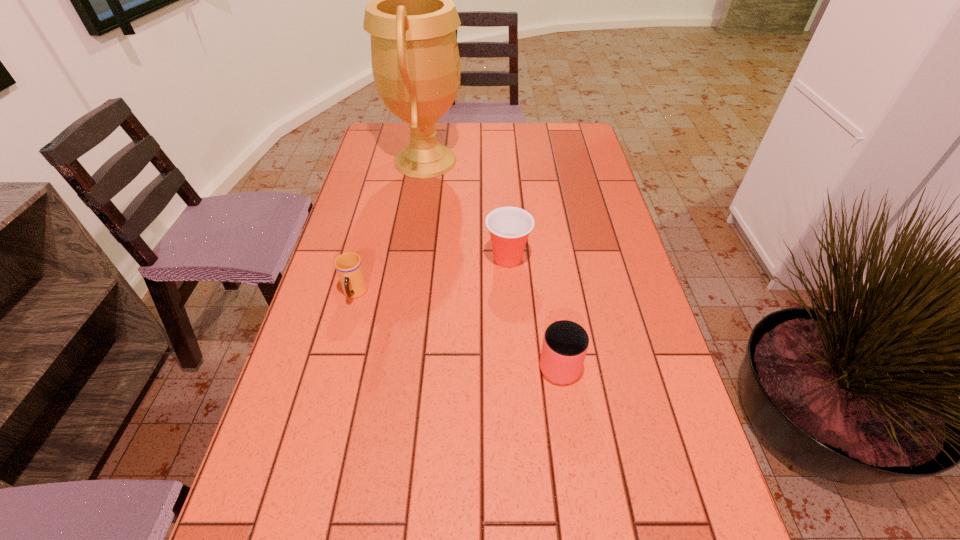
Where is `object that is the third closest to the second farthest cup`? object that is the third closest to the second farthest cup is located at coordinates (565, 344).

At what (x,y) coordinates should I click in order to perform the action: click on object that is the closest to the third nearest object. Please return your answer as a coordinate pair (x, y). The image size is (960, 540). Looking at the image, I should click on (412, 20).

I want to click on the closest cup relative to the nearest cup, so click(x=509, y=227).

Locate an element on the screen. The image size is (960, 540). cup that stands as the closest to the second nearest object is located at coordinates (509, 227).

You are a GUI agent. You are given a task and a screenshot of the screen. Output one action in this format:
    pyautogui.click(x=<x>, y=<y>)
    Task: Click on the free space in the image that satisfies the following two spatial constraints: 1. on the engravings side of the trophy; 2. on the right side of the third nearest object
    The image size is (960, 540).
    Given the screenshot: What is the action you would take?
    pyautogui.click(x=410, y=259)

Find the location of a particular element. vacant region that satisfies the following two spatial constraints: 1. on the engravings side of the trophy; 2. on the side of the second nearest object with the handle is located at coordinates click(x=404, y=294).

You are a GUI agent. You are given a task and a screenshot of the screen. Output one action in this format:
    pyautogui.click(x=<x>, y=<y>)
    Task: Click on the free space that satisfies the following two spatial constraints: 1. on the engravings side of the tallest object; 2. on the back side of the third nearest object
    The image size is (960, 540).
    Given the screenshot: What is the action you would take?
    pyautogui.click(x=410, y=259)

Identify the location of vacant area in the image that satisfies the following two spatial constraints: 1. on the engravings side of the farthest cup; 2. on the right side of the trophy. This screenshot has width=960, height=540. (410, 259).

The image size is (960, 540). In order to click on free spot that satisfies the following two spatial constraints: 1. on the engravings side of the farthest object; 2. on the side of the second nearest object with the handle in this screenshot , I will do `click(404, 294)`.

In order to click on free location that satisfies the following two spatial constraints: 1. on the engravings side of the farthest cup; 2. on the left side of the tallest object in this screenshot , I will do `click(410, 259)`.